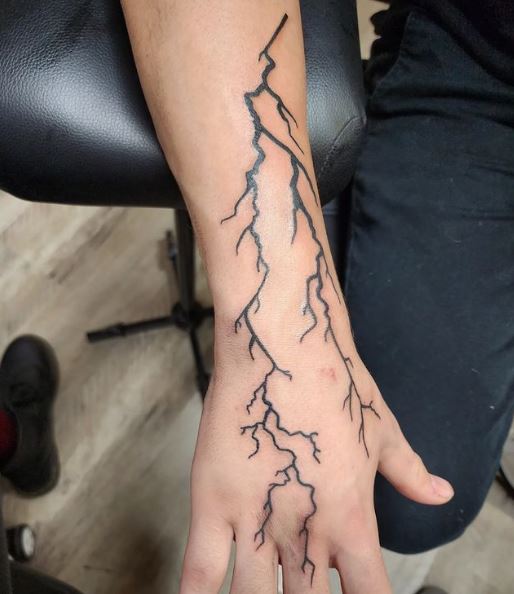
Locate an element on the screen. This screenshot has width=514, height=594. wood floor is located at coordinates (142, 388).